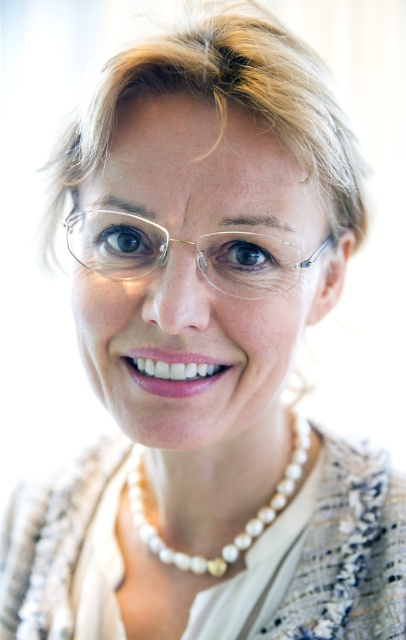
Question: Which point is closer to the camera?

Choices:
 (A) (224, 252)
 (B) (151, 225)

Answer: (B)

Question: Does clear plastic glasses at center have a larger size compared to brown glossy eye at center?

Choices:
 (A) yes
 (B) no

Answer: (A)

Question: Does pearl necklace at center come in front of blue glossy eye at center?

Choices:
 (A) no
 (B) yes

Answer: (A)

Question: Which of the following is the closest to the observer?

Choices:
 (A) (259, 240)
 (B) (97, 253)
 (C) (151, 241)
 (D) (142, 496)

Answer: (A)

Question: Can you confirm if pearl necklace at center is positioned above blue glossy eye at center?

Choices:
 (A) yes
 (B) no

Answer: (B)

Question: Which point appears farthest from the camera in this image?

Choices:
 (A) 252,273
 (B) 129,234
 (C) 131,483
 (D) 77,253

Answer: (C)